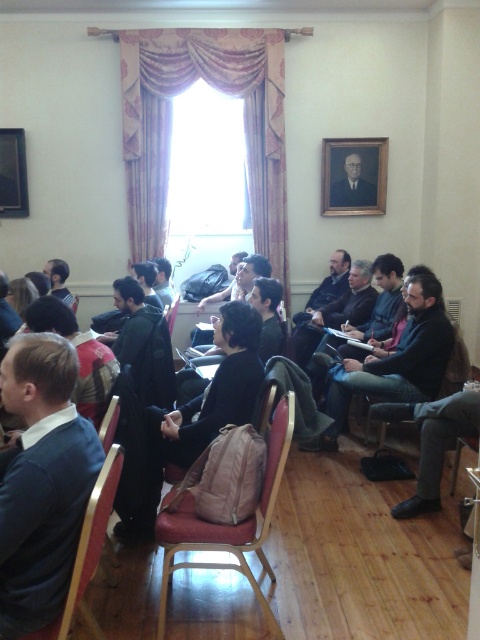
Which of these two, wooden portrait frame at upper center or wooden picture frame at upper left, stands taller?

wooden picture frame at upper left

Between wooden portrait frame at upper center and wooden picture frame at upper left, which one appears on the right side from the viewer's perspective?

Positioned to the right is wooden portrait frame at upper center.

Is point (376, 141) positioned in front of point (10, 209)?

No, it is not.

The width and height of the screenshot is (480, 640). In order to click on wooden portrait frame at upper center in this screenshot , I will do `click(354, 177)`.

Which is in front, point (158, 472) or point (370, 408)?

Point (158, 472)

Between point (259, 337) and point (459, 358), which one is positioned behind?

The point (459, 358) is behind.

Is point (146, 524) farther from viewer compared to point (464, 358)?

No, it is not.

In order to click on brown leather backpack at center in this screenshot , I will do pos(192,420).

Is wooden portrait frame at upper center smaller than metallic silver chair at lower right?

Actually, wooden portrait frame at upper center might be larger than metallic silver chair at lower right.

Find the location of a particular element. The width and height of the screenshot is (480, 640). wooden portrait frame at upper center is located at coordinates (354, 177).